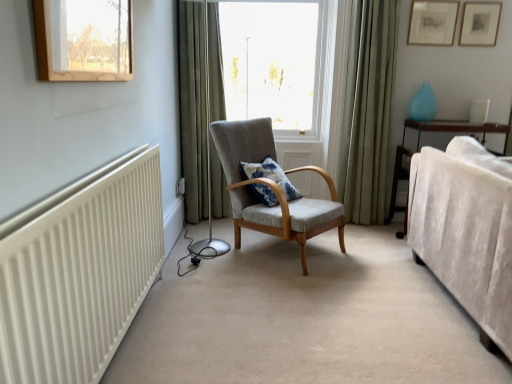
Question: Does textured gray armchair at center have a larger size compared to matte wooden picture frame at upper right, the 1th picture frame when ordered from right to left?

Choices:
 (A) yes
 (B) no

Answer: (A)

Question: Is textured gray armchair at center thinner than matte wooden picture frame at upper right, the 1th picture frame when ordered from right to left?

Choices:
 (A) no
 (B) yes

Answer: (A)

Question: Can you confirm if textured gray armchair at center is smaller than matte wooden picture frame at upper right, the 1th picture frame when ordered from right to left?

Choices:
 (A) yes
 (B) no

Answer: (B)

Question: Is the depth of textured gray armchair at center greater than that of matte wooden picture frame at upper right, the 1th picture frame when ordered from right to left?

Choices:
 (A) no
 (B) yes

Answer: (A)

Question: From a real-world perspective, is textured gray armchair at center positioned under matte wooden picture frame at upper right, the 2th picture frame viewed from the left, based on gravity?

Choices:
 (A) no
 (B) yes

Answer: (B)

Question: Do you think green fabric curtain at center, marked as the first curtain in a left-to-right arrangement, is within matte gold picture frame at upper right, marked as the first picture frame in a left-to-right arrangement, or outside of it?

Choices:
 (A) outside
 (B) inside

Answer: (A)

Question: Considering the positions of green fabric curtain at center, placed as the second curtain when sorted from right to left, and matte gold picture frame at upper right, which is the 2th picture frame from right to left, in the image, is green fabric curtain at center, placed as the second curtain when sorted from right to left, wider or thinner than matte gold picture frame at upper right, which is the 2th picture frame from right to left,?

Choices:
 (A) wide
 (B) thin

Answer: (A)

Question: From the image's perspective, is green fabric curtain at center, placed as the second curtain when sorted from right to left, above or below matte gold picture frame at upper right, marked as the first picture frame in a left-to-right arrangement?

Choices:
 (A) below
 (B) above

Answer: (A)

Question: In terms of height, does green fabric curtain at center, marked as the first curtain in a left-to-right arrangement, look taller or shorter compared to matte gold picture frame at upper right, which is the 2th picture frame from right to left?

Choices:
 (A) short
 (B) tall

Answer: (B)

Question: In terms of height, does velvet beige couch at right look taller or shorter compared to green fabric curtain at center, marked as the first curtain in a left-to-right arrangement?

Choices:
 (A) short
 (B) tall

Answer: (A)

Question: Based on their sizes in the image, would you say velvet beige couch at right is bigger or smaller than green fabric curtain at center, placed as the second curtain when sorted from right to left?

Choices:
 (A) small
 (B) big

Answer: (B)

Question: From the image's perspective, relative to green fabric curtain at center, marked as the first curtain in a left-to-right arrangement, is velvet beige couch at right above or below?

Choices:
 (A) above
 (B) below

Answer: (B)

Question: From a real-world perspective, is velvet beige couch at right above or below green fabric curtain at center, marked as the first curtain in a left-to-right arrangement?

Choices:
 (A) above
 (B) below

Answer: (B)

Question: Is matte wooden picture frame at upper right, the 2th picture frame viewed from the left, inside the boundaries of transparent glass window at center, or outside?

Choices:
 (A) inside
 (B) outside

Answer: (B)

Question: Considering the relative positions of matte wooden picture frame at upper right, the 1th picture frame when ordered from right to left, and transparent glass window at center in the image provided, is matte wooden picture frame at upper right, the 1th picture frame when ordered from right to left, to the left or to the right of transparent glass window at center?

Choices:
 (A) left
 (B) right

Answer: (B)